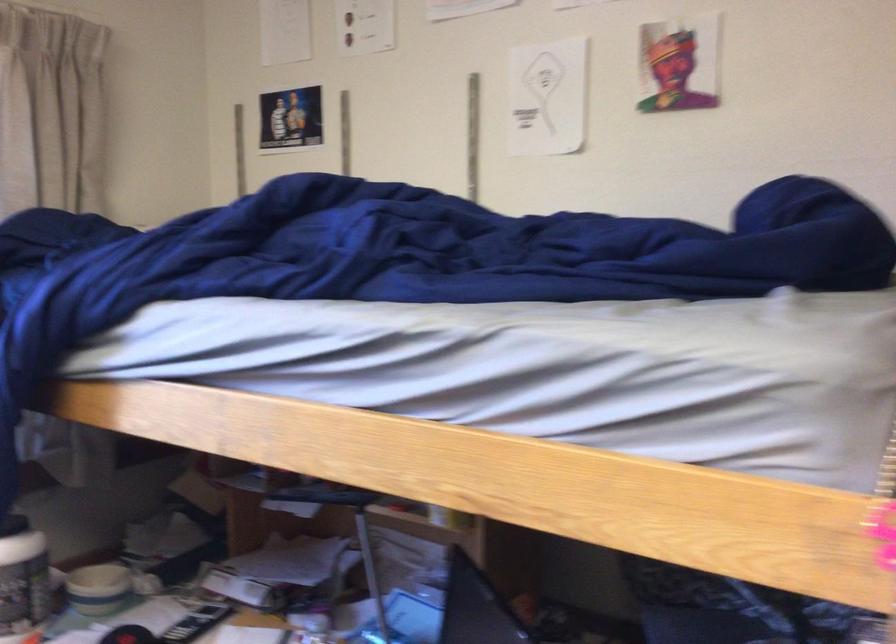
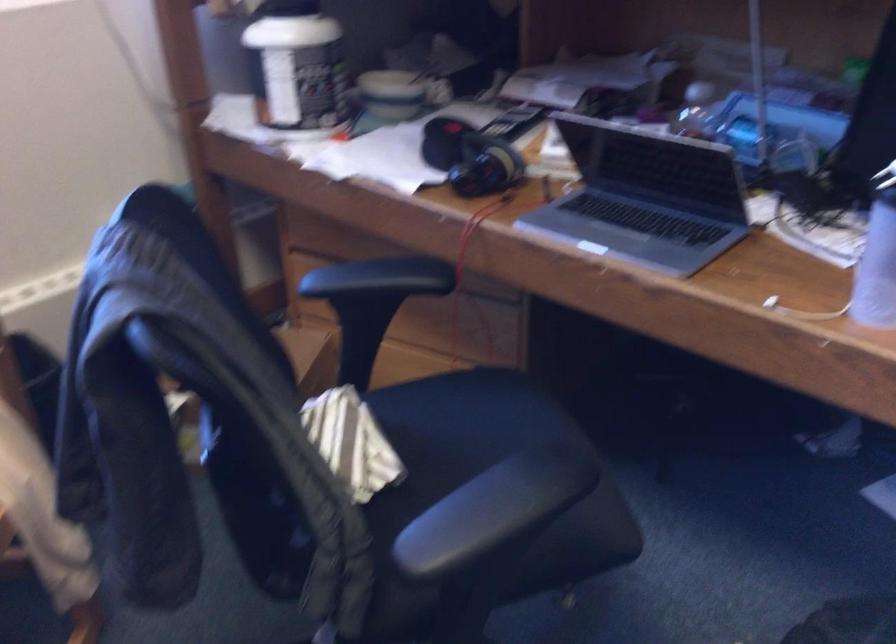
Question: In a continuous first-person perspective shot, in which direction is the camera moving?

Choices:
 (A) Left
 (B) Right
 (C) Forward
 (D) Backward

Answer: (A)